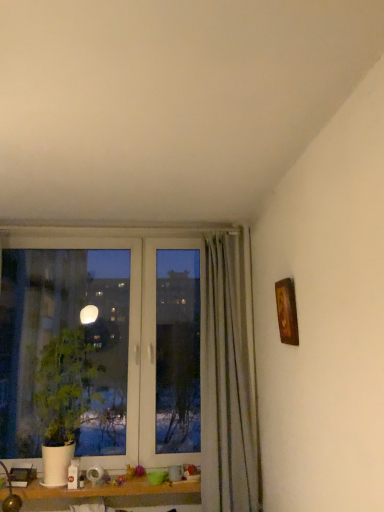
Question: Is wooden frame at upper right surrounding white matte pot at left?

Choices:
 (A) yes
 (B) no

Answer: (B)

Question: Is wooden frame at upper right not within white matte pot at left?

Choices:
 (A) no
 (B) yes

Answer: (B)

Question: From a real-world perspective, is wooden frame at upper right beneath white matte pot at left?

Choices:
 (A) no
 (B) yes

Answer: (A)

Question: Considering the relative sizes of wooden frame at upper right and white matte pot at left in the image provided, is wooden frame at upper right thinner than white matte pot at left?

Choices:
 (A) no
 (B) yes

Answer: (B)

Question: Is wooden frame at upper right at the right side of white matte pot at left?

Choices:
 (A) yes
 (B) no

Answer: (A)

Question: From the image's perspective, does wooden frame at upper right appear lower than white matte pot at left?

Choices:
 (A) no
 (B) yes

Answer: (A)

Question: From the image's perspective, is white matte pot at left located above wooden frame at upper right?

Choices:
 (A) yes
 (B) no

Answer: (B)

Question: From the image's perspective, is white matte pot at left located beneath wooden frame at upper right?

Choices:
 (A) no
 (B) yes

Answer: (B)

Question: Is white matte pot at left positioned far away from wooden frame at upper right?

Choices:
 (A) no
 (B) yes

Answer: (B)

Question: Is white matte pot at left facing away from wooden frame at upper right?

Choices:
 (A) no
 (B) yes

Answer: (A)

Question: From a real-world perspective, does white matte pot at left sit lower than wooden frame at upper right?

Choices:
 (A) yes
 (B) no

Answer: (A)

Question: Is white matte pot at left behind wooden frame at upper right?

Choices:
 (A) yes
 (B) no

Answer: (A)

Question: Based on their positions, is wooden frame at upper right located to the left or right of white matte pot at left?

Choices:
 (A) left
 (B) right

Answer: (B)